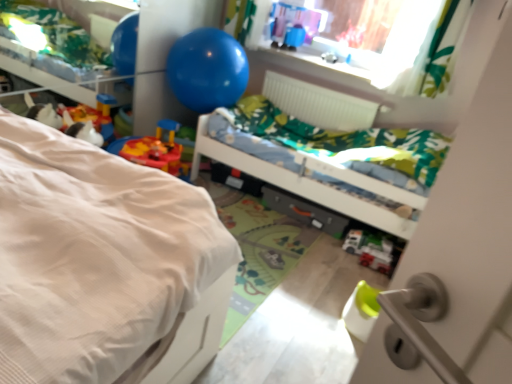
Question: Does metallic gray drawer at center contain green fabric bed at center, which is the 2th bed in front-to-back order?

Choices:
 (A) no
 (B) yes

Answer: (A)

Question: Can you see metallic gray drawer at center touching green fabric bed at center, which is the 2th bed in front-to-back order?

Choices:
 (A) yes
 (B) no

Answer: (B)

Question: Does metallic gray drawer at center appear on the left side of green fabric bed at center, which is the first bed from back to front?

Choices:
 (A) no
 (B) yes

Answer: (B)

Question: Does metallic gray drawer at center lie behind green fabric bed at center, which is the first bed from back to front?

Choices:
 (A) no
 (B) yes

Answer: (B)

Question: From a real-world perspective, does metallic gray drawer at center sit lower than green fabric bed at center, which is the first bed from back to front?

Choices:
 (A) yes
 (B) no

Answer: (A)

Question: Does metallic gray drawer at center have a lesser width compared to green fabric bed at center, which is the first bed from back to front?

Choices:
 (A) no
 (B) yes

Answer: (B)

Question: From the image's perspective, would you say green fabric bed at center, which is the first bed from back to front, is shown under white textured bed at left, positioned as the first bed in front-to-back order?

Choices:
 (A) yes
 (B) no

Answer: (B)

Question: Considering the relative sizes of green fabric bed at center, which is the first bed from back to front, and white textured bed at left, positioned as the first bed in front-to-back order, in the image provided, is green fabric bed at center, which is the first bed from back to front, smaller than white textured bed at left, positioned as the first bed in front-to-back order,?

Choices:
 (A) yes
 (B) no

Answer: (A)

Question: Is green fabric bed at center, which is the 2th bed in front-to-back order, outside white textured bed at left, the second bed viewed from the back?

Choices:
 (A) yes
 (B) no

Answer: (A)

Question: Is green fabric bed at center, which is the 2th bed in front-to-back order, facing away from white textured bed at left, the second bed viewed from the back?

Choices:
 (A) no
 (B) yes

Answer: (A)

Question: Are green fabric bed at center, which is the first bed from back to front, and white textured bed at left, the second bed viewed from the back, located far from each other?

Choices:
 (A) yes
 (B) no

Answer: (A)

Question: Is green fabric bed at center, which is the 2th bed in front-to-back order, facing towards white textured bed at left, positioned as the first bed in front-to-back order?

Choices:
 (A) yes
 (B) no

Answer: (B)

Question: Considering the relative sizes of white plastic toy car at lower center, placed as the 2th toy when sorted from left to right, and blue rubber balloon at upper center in the image provided, is white plastic toy car at lower center, placed as the 2th toy when sorted from left to right, thinner than blue rubber balloon at upper center?

Choices:
 (A) yes
 (B) no

Answer: (A)